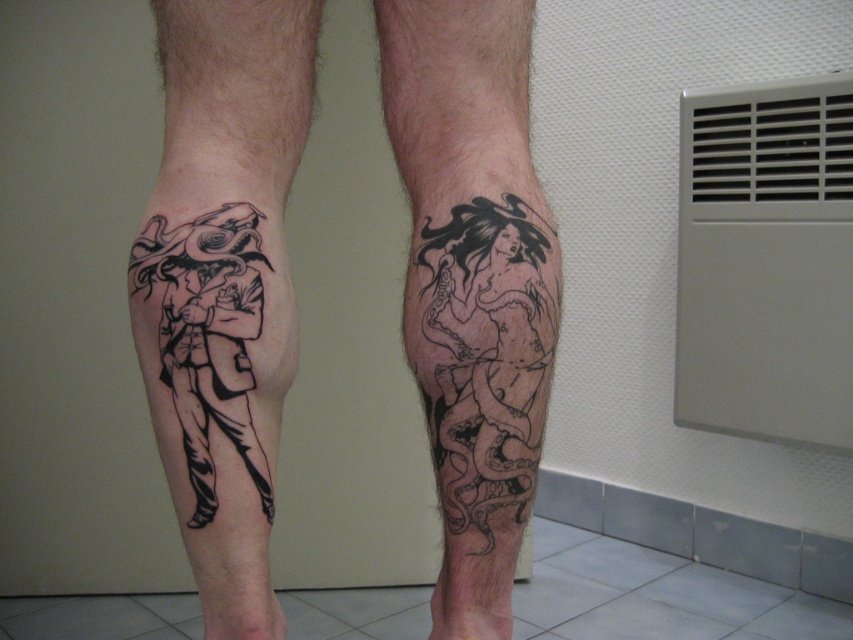
Question: Which object is the closest to the black ink tattoo at lower center?

Choices:
 (A) black ink snake at lower center
 (B) black ink tattoo at lower left

Answer: (A)

Question: Is black ink tattoo at lower center bigger than black ink snake at lower center?

Choices:
 (A) yes
 (B) no

Answer: (A)

Question: Is black ink tattoo at lower left positioned before black ink snake at lower center?

Choices:
 (A) no
 (B) yes

Answer: (B)

Question: Which object is closer to the camera taking this photo?

Choices:
 (A) black ink tattoo at lower center
 (B) black ink tattoo at lower left

Answer: (B)

Question: Which of the following is the closest to the observer?

Choices:
 (A) tap(433, 248)
 (B) tap(242, 72)

Answer: (A)

Question: Does black ink tattoo at lower left have a larger size compared to black ink snake at lower center?

Choices:
 (A) no
 (B) yes

Answer: (B)